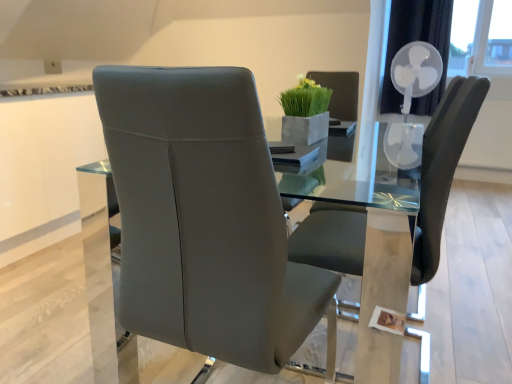
Question: Is green matte vase at upper center bigger or smaller than white plastic fan at upper right?

Choices:
 (A) big
 (B) small

Answer: (B)

Question: From a real-world perspective, is green matte vase at upper center physically located above or below white plastic fan at upper right?

Choices:
 (A) below
 (B) above

Answer: (B)

Question: Estimate the real-world distances between objects in this image. Which object is farther from the white plastic fan at upper right?

Choices:
 (A) satin grey leather chair at center, the first chair from the left
 (B) green matte vase at upper center
 (C) matte gray chair at center, marked as the 1th chair in a right-to-left arrangement

Answer: (A)

Question: Estimate the real-world distances between objects in this image. Which object is closer to the satin grey leather chair at center, which is counted as the 2th chair, starting from the right?

Choices:
 (A) white plastic fan at upper right
 (B) matte gray chair at center, marked as the 1th chair in a right-to-left arrangement
 (C) green matte vase at upper center

Answer: (B)